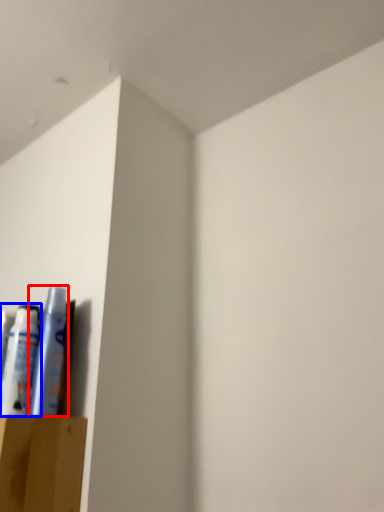
Question: Which object appears closest to the camera in this image, toiletry (highlighted by a red box) or toiletry (highlighted by a blue box)?

Choices:
 (A) toiletry
 (B) toiletry

Answer: (A)